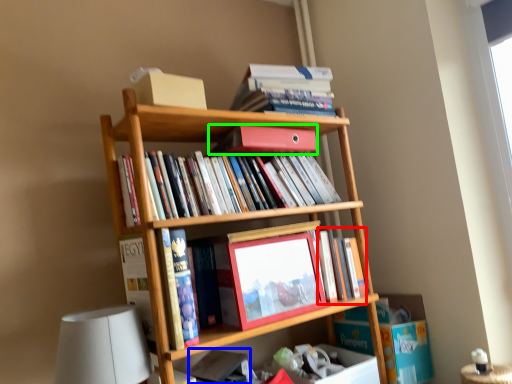
Question: Which object is the farthest from book (highlighted by a red box)? Choose among these: book (highlighted by a blue box) or book (highlighted by a green box).

Choices:
 (A) book
 (B) book

Answer: (A)